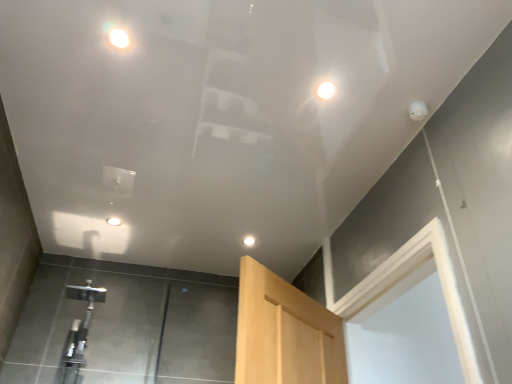
Measure the distance between point [321,89] and camera.

Point [321,89] and camera are 1.62 meters apart from each other.

Where is `white glossy droplight at upper center, arranged as the 1th droplight when viewed from the back`? The width and height of the screenshot is (512, 384). white glossy droplight at upper center, arranged as the 1th droplight when viewed from the back is located at coordinates (249, 241).

From the picture: In order to face white glossy droplight at upper center, which is the third droplight from front to back, should I rotate leftwards or rightwards?

You should look left and rotate roughly 18.240 degrees.

Locate an element on the screen. This screenshot has height=384, width=512. matte white droplight at upper center, the 4th droplight positioned from the back is located at coordinates (117, 36).

What are the coordinates of `white glossy droplight at upper center, the first droplight when ordered from right to left` in the screenshot? It's located at (326, 90).

Can you tell me how much white glossy droplight at upper center, acting as the 2th droplight starting from the top, and white glossy droplight at upper center, arranged as the fourth droplight when viewed from the top, differ in facing direction?

0.686 degrees.

In terms of height, does white glossy droplight at upper center, acting as the 2th droplight starting from the top, look taller or shorter compared to white glossy droplight at upper center, arranged as the fourth droplight when viewed from the top?

Considering their sizes, white glossy droplight at upper center, acting as the 2th droplight starting from the top, has less height than white glossy droplight at upper center, arranged as the fourth droplight when viewed from the top.

Looking at this image, from the image's perspective, is white glossy droplight at upper center, acting as the 2th droplight starting from the top, located above or below white glossy droplight at upper center, which is the third droplight from left to right?

white glossy droplight at upper center, acting as the 2th droplight starting from the top, is situated higher than white glossy droplight at upper center, which is the third droplight from left to right, in the image.

Considering the positions of objects white glossy droplight at upper center, the third droplight in the bottom-to-top sequence, and white glossy droplight at upper center, arranged as the fourth droplight when viewed from the top, in the image provided, who is more to the left, white glossy droplight at upper center, the third droplight in the bottom-to-top sequence, or white glossy droplight at upper center, arranged as the fourth droplight when viewed from the top,?

From the viewer's perspective, white glossy droplight at upper center, arranged as the fourth droplight when viewed from the top, appears more on the left side.

Is white glossy droplight at upper center, acting as the 2th droplight starting from the top, inside or outside of white glossy droplight at upper center, the 1th droplight when ordered from left to right?

white glossy droplight at upper center, acting as the 2th droplight starting from the top, is spatially situated outside white glossy droplight at upper center, the 1th droplight when ordered from left to right.

Starting from the white glossy droplight at upper center, placed as the second droplight when sorted from front to back, which droplight is the 3rd one to the left? Please provide its 2D coordinates.

[(113, 221)]

From the image's perspective, is white glossy droplight at upper center, acting as the 3th droplight starting from the back, above white glossy droplight at upper center, which ranks as the 2th droplight in bottom-to-top order?

Indeed, from the image's perspective, white glossy droplight at upper center, acting as the 3th droplight starting from the back, is shown above white glossy droplight at upper center, which ranks as the 2th droplight in bottom-to-top order.

From a real-world perspective, between white glossy droplight at upper center, acting as the 2th droplight starting from the top, and white glossy droplight at upper center, the 1th droplight when ordered from left to right, who is vertically lower?

white glossy droplight at upper center, the 1th droplight when ordered from left to right, is physically lower.

Based on their sizes in the image, would you say matte white droplight at upper center, arranged as the 3th droplight when viewed from the right, is bigger or smaller than white glossy droplight at upper center, the 1th droplight when ordered from left to right?

Clearly, matte white droplight at upper center, arranged as the 3th droplight when viewed from the right, is smaller in size than white glossy droplight at upper center, the 1th droplight when ordered from left to right.

Is white glossy droplight at upper center, which appears as the 2th droplight when viewed from the back, surrounded by matte white droplight at upper center, acting as the second droplight starting from the left?

That's incorrect, white glossy droplight at upper center, which appears as the 2th droplight when viewed from the back, is not inside matte white droplight at upper center, acting as the second droplight starting from the left.

Where is `droplight that is the 1st object to the right of the white glossy droplight at upper center, the fourth droplight viewed from the right, starting at the anchor`? droplight that is the 1st object to the right of the white glossy droplight at upper center, the fourth droplight viewed from the right, starting at the anchor is located at coordinates (117, 36).

Is white glossy droplight at upper center, which ranks as the third droplight in top-to-bottom order, at the back of matte white droplight at upper center, the 1th droplight in the top-to-bottom sequence?

No, matte white droplight at upper center, the 1th droplight in the top-to-bottom sequence, is not facing the opposite direction of white glossy droplight at upper center, which ranks as the third droplight in top-to-bottom order.

From the picture: Between matte white droplight at upper center, the 1th droplight in the top-to-bottom sequence, and white glossy droplight at upper center, which is the 4th droplight in front-to-back order, which one appears on the left side from the viewer's perspective?

From the viewer's perspective, matte white droplight at upper center, the 1th droplight in the top-to-bottom sequence, appears more on the left side.

Is matte white droplight at upper center, acting as the second droplight starting from the left, further to camera compared to white glossy droplight at upper center, which is the third droplight from left to right?

No, it is not.

Is point (106, 30) farther from camera compared to point (249, 244)?

No, (106, 30) is in front of (249, 244).

From a real-world perspective, is white glossy droplight at upper center, which is counted as the second droplight, starting from the right, physically below satin nickel faucet at lower left?

Incorrect, from a real-world perspective, white glossy droplight at upper center, which is counted as the second droplight, starting from the right, is higher than satin nickel faucet at lower left.

Looking at their sizes, would you say white glossy droplight at upper center, which is the 4th droplight in front-to-back order, is wider or thinner than satin nickel faucet at lower left?

white glossy droplight at upper center, which is the 4th droplight in front-to-back order, is thinner than satin nickel faucet at lower left.

Could you measure the distance between white glossy droplight at upper center, which is counted as the second droplight, starting from the right, and satin nickel faucet at lower left?

They are 3.64 feet apart.

From the picture: Is white glossy droplight at upper center, which ranks as the 1th droplight in bottom-to-top order, at the right side of satin nickel faucet at lower left?

Correct, you'll find white glossy droplight at upper center, which ranks as the 1th droplight in bottom-to-top order, to the right of satin nickel faucet at lower left.

Relative to white glossy droplight at upper center, the fourth droplight viewed from the left, is satin nickel faucet at lower left in front or behind?

Clearly, satin nickel faucet at lower left is behind white glossy droplight at upper center, the fourth droplight viewed from the left.

In the scene shown: Is satin nickel faucet at lower left positioned far away from white glossy droplight at upper center, placed as the second droplight when sorted from front to back?

satin nickel faucet at lower left is positioned a significant distance from white glossy droplight at upper center, placed as the second droplight when sorted from front to back.

In the scene shown: Considering the relative sizes of satin nickel faucet at lower left and white glossy droplight at upper center, the first droplight when ordered from right to left, in the image provided, is satin nickel faucet at lower left shorter than white glossy droplight at upper center, the first droplight when ordered from right to left,?

No.

From the image's perspective, is satin nickel faucet at lower left beneath white glossy droplight at upper center, the first droplight when ordered from right to left?

Indeed, from the image's perspective, satin nickel faucet at lower left is shown beneath white glossy droplight at upper center, the first droplight when ordered from right to left.

Between white glossy droplight at upper center, the fourth droplight viewed from the left, and satin nickel faucet at lower left, which one has larger size?

satin nickel faucet at lower left.

Can you see white glossy droplight at upper center, the third droplight in the bottom-to-top sequence, touching satin nickel faucet at lower left?

No, white glossy droplight at upper center, the third droplight in the bottom-to-top sequence, is not next to satin nickel faucet at lower left.

Measure the distance between white glossy droplight at upper center, acting as the 2th droplight starting from the top, and satin nickel faucet at lower left.

white glossy droplight at upper center, acting as the 2th droplight starting from the top, and satin nickel faucet at lower left are 1.97 meters apart from each other.

This screenshot has width=512, height=384. What are the coordinates of `faucet behind the white glossy droplight at upper center, the first droplight when ordered from right to left` in the screenshot? It's located at (78, 332).

Locate an element on the screen. The height and width of the screenshot is (384, 512). droplight that is the 1st one when counting leftward from the white glossy droplight at upper center, acting as the 2th droplight starting from the top is located at coordinates (249, 241).

Where is `droplight that is the 1st object directly below the white glossy droplight at upper center, acting as the 3th droplight starting from the back (from a real-world perspective)`? droplight that is the 1st object directly below the white glossy droplight at upper center, acting as the 3th droplight starting from the back (from a real-world perspective) is located at coordinates (113, 221).

Considering their positions, is white glossy droplight at upper center, which ranks as the 1th droplight in bottom-to-top order, positioned closer to satin nickel faucet at lower left than matte white droplight at upper center, the 4th droplight positioned from the back?

white glossy droplight at upper center, which ranks as the 1th droplight in bottom-to-top order, is positioned closer to the anchor satin nickel faucet at lower left.

When comparing their distances from satin nickel faucet at lower left, does matte white droplight at upper center, the 4th droplight positioned from the back, or white glossy droplight at upper center, arranged as the fourth droplight when viewed from the top, seem closer?

white glossy droplight at upper center, arranged as the fourth droplight when viewed from the top.

When comparing their distances from white glossy droplight at upper center, placed as the second droplight when sorted from front to back, does matte white droplight at upper center, the 4th droplight positioned from the back, or white glossy droplight at upper center, which ranks as the third droplight in top-to-bottom order, seem further?

Based on the image, white glossy droplight at upper center, which ranks as the third droplight in top-to-bottom order, appears to be further to white glossy droplight at upper center, placed as the second droplight when sorted from front to back.

Considering their positions, is satin nickel faucet at lower left positioned further to white glossy droplight at upper center, which appears as the 2th droplight when viewed from the back, than matte white droplight at upper center, arranged as the first droplight when viewed from the front?

Among the two, matte white droplight at upper center, arranged as the first droplight when viewed from the front, is located further to white glossy droplight at upper center, which appears as the 2th droplight when viewed from the back.

When comparing their distances from white glossy droplight at upper center, the 1th droplight when ordered from left to right, does white glossy droplight at upper center, arranged as the 1th droplight when viewed from the back, or matte white droplight at upper center, the 4th droplight positioned from the back, seem further?

Among the two, matte white droplight at upper center, the 4th droplight positioned from the back, is located further to white glossy droplight at upper center, the 1th droplight when ordered from left to right.

Which object lies nearer to the anchor point matte white droplight at upper center, arranged as the first droplight when viewed from the front, satin nickel faucet at lower left or white glossy droplight at upper center, which is the 4th droplight in front-to-back order?

white glossy droplight at upper center, which is the 4th droplight in front-to-back order, is positioned closer to the anchor matte white droplight at upper center, arranged as the first droplight when viewed from the front.

Based on their spatial positions, is white glossy droplight at upper center, acting as the 3th droplight starting from the back, or satin nickel faucet at lower left closer to white glossy droplight at upper center, which ranks as the 2th droplight in bottom-to-top order?

satin nickel faucet at lower left.

Considering their positions, is satin nickel faucet at lower left positioned closer to white glossy droplight at upper center, which is counted as the second droplight, starting from the right, than matte white droplight at upper center, the fourth droplight in the bottom-to-top sequence?

satin nickel faucet at lower left lies closer to white glossy droplight at upper center, which is counted as the second droplight, starting from the right, than the other object.